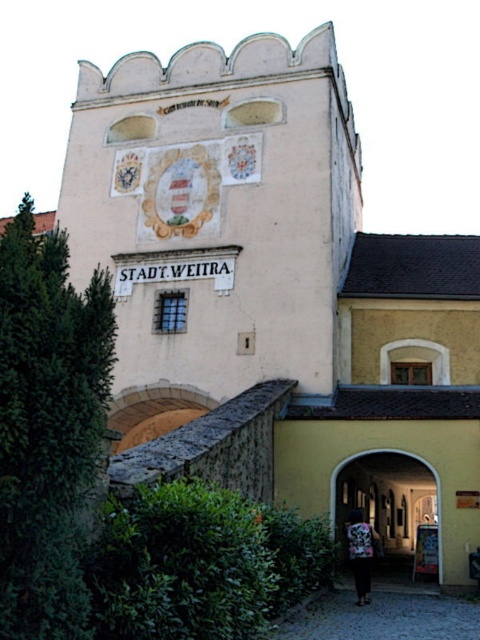
Between dark fabric bag at center and matte stone archway at center, which one is positioned higher?

matte stone archway at center is higher up.

Does point (364, 554) lie behind point (421, 460)?

No, it is not.

Find the location of a particular element. This screenshot has width=480, height=640. dark fabric bag at center is located at coordinates (360, 552).

Identify the location of dark fabric bag at center. This screenshot has height=640, width=480. (360, 552).